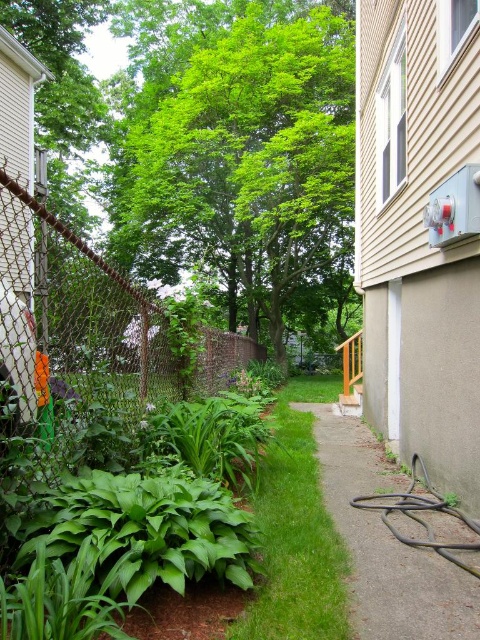
You are standing at the entrance of the backyard and want to plant a new tree exactly where the green leafy tree at center is currently located. What are the coordinates of the spot where you should plant the new tree?

The coordinates for the spot where the green leafy tree at center is located are at point (248, 161).

You are planning to place a 2m wide garden bench in your backyard. You have two options for placement near the green leafy tree at center or near the black rubber hose at lower right. Based on their widths, which location would allow the bench to fit better?

The green leafy tree at center has a larger width than the black rubber hose at lower right. Since the bench is 2m wide, placing it near the wider area around the green leafy tree at center would provide more space for the bench to fit comfortably.